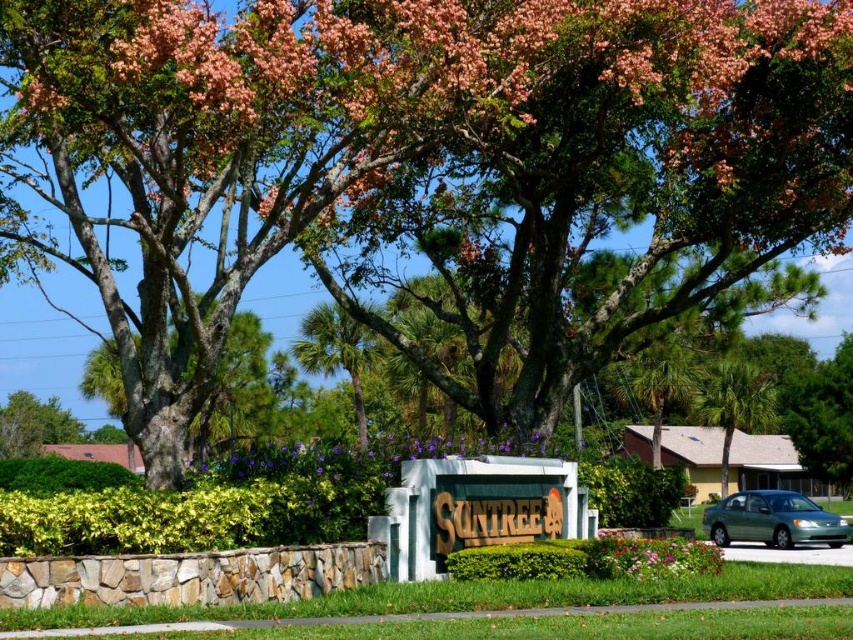
You are a gardener planning to place a new decorative item in the garden. You have a small statue that is 1 meter wide. The multicolored fabric flower at lower center and the green leafy tree at upper left are already in the garden. Can the statue fit between them without overlapping?

The multicolored fabric flower at lower center is wider than the green leafy tree at upper left. However, since the exact distance between them isn